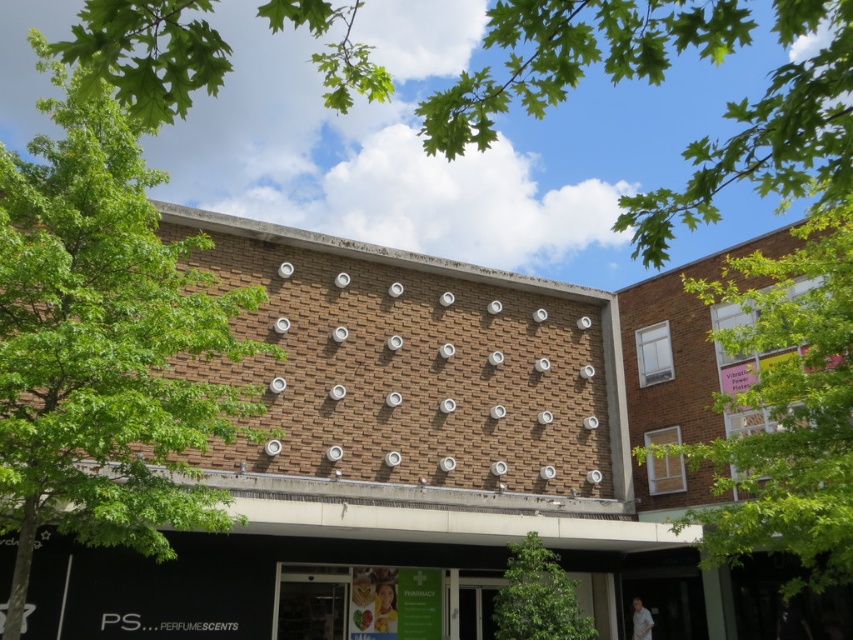
You are standing at point [447,124] and want to take a photo of the building. The camera you have can only focus on objects within 2 meters. Will the camera be able to focus on the building?

The point [447,124] and the camera are 2.87 meters apart, which is beyond the camera focus range of 2 meters. Therefore, the camera will not be able to focus on the building.

You are standing in front of the building and notice the green leafy tree at upper left. Based on its position, can you determine if it is closer to the brick facade or the black awning?

The green leafy tree at upper left is located at point coordinates closer to the brick facade than the black awning. Since the tree is at upper left, it is positioned higher up near the brick section, so it is closer to the brick facade.